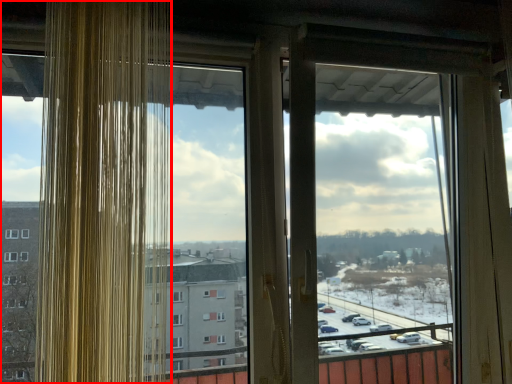
Question: From the image's perspective, where is window (annotated by the red box) located in relation to screen door in the image?

Choices:
 (A) below
 (B) above

Answer: (B)